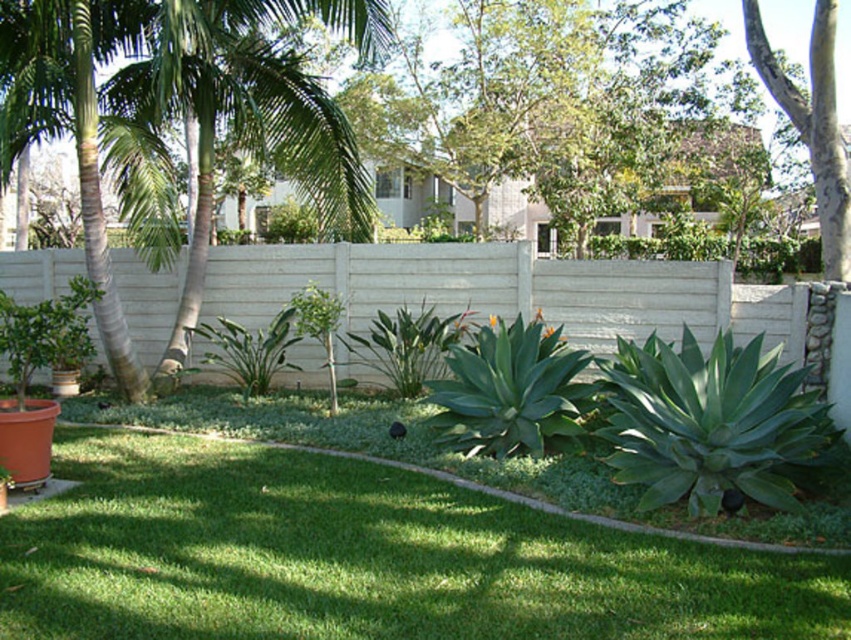
Question: Does green grass at center come in front of smooth gray bark tree at upper right?

Choices:
 (A) yes
 (B) no

Answer: (A)

Question: Considering the real-world distances, which object is farthest from the smooth gray bark tree at upper right?

Choices:
 (A) green leafy palm tree at left
 (B) green grass at center

Answer: (B)

Question: Observing the image, what is the correct spatial positioning of green grass at center in reference to green leafy palm tree at left?

Choices:
 (A) left
 (B) right

Answer: (B)

Question: Which point is closer to the camera?

Choices:
 (A) (827, 83)
 (B) (113, 90)

Answer: (A)

Question: Where is green grass at center located in relation to smooth gray bark tree at upper right in the image?

Choices:
 (A) above
 (B) below

Answer: (B)

Question: Which point appears farthest from the camera in this image?

Choices:
 (A) (837, 227)
 (B) (638, 547)

Answer: (A)